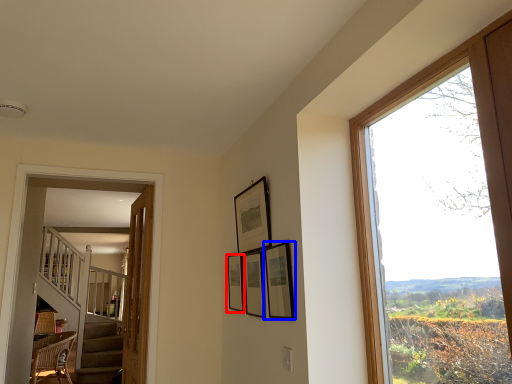
Question: Which object is further to the camera taking this photo, picture frame (highlighted by a red box) or picture frame (highlighted by a blue box)?

Choices:
 (A) picture frame
 (B) picture frame

Answer: (A)